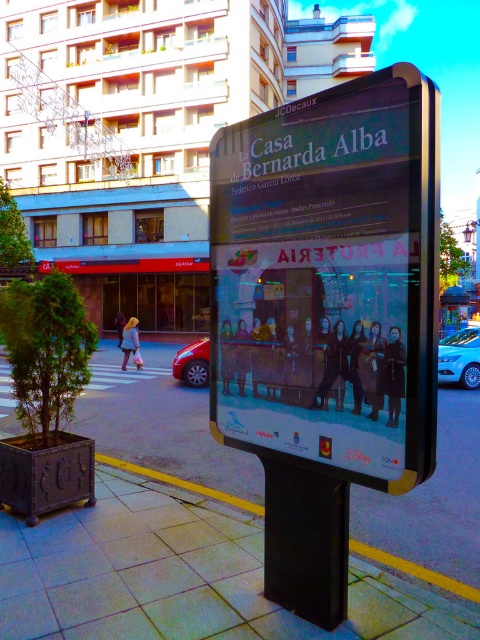
You are a delivery person who needs to park your shiny red car at center on the smooth concrete pavement at center. Can your car fit on the pavement?

The smooth concrete pavement at center is wider than the shiny red car at center, so the car can fit on the pavement.

You are a photographer standing in front of the billboard for the play. You want to take a photo that includes both the point at coordinates point (x=97, y=385) and point (x=188, y=372). Which point should you focus on to ensure both are in sharp focus?

You should focus on the point that is closer to the camera, which is point (x=188, y=372), to ensure both points are in sharp focus.

You are a pedestrian standing on the sidewalk looking at the metallic poster at center and the blue metallic car at lower right. Which object appears taller from your perspective?

The metallic poster at center appears taller than the blue metallic car at lower right because the metallic poster at center is much taller as blue metallic car at lower right.